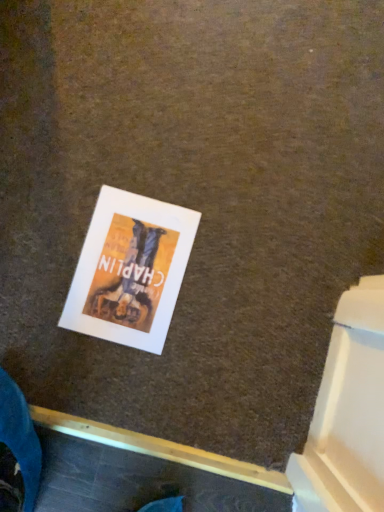
I want to click on free space in front of matte paper poster at center, so (120, 381).